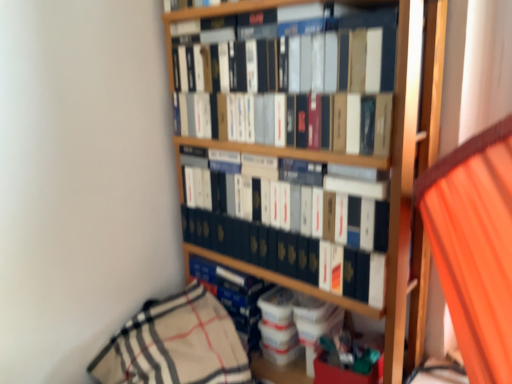
Question: Should I look upward or downward to see matte black book at upper center, which appears as the 1th book when viewed from the top?

Choices:
 (A) down
 (B) up

Answer: (B)

Question: Is blue hardcover book at center, which appears as the 1th book when ordered from the bottom, wider than matte black book at upper center, which appears as the 1th book when viewed from the top?

Choices:
 (A) yes
 (B) no

Answer: (A)

Question: Considering the relative sizes of blue hardcover book at center, the 3th book from the top, and matte black book at upper center, which appears as the 1th book when viewed from the top, in the image provided, is blue hardcover book at center, the 3th book from the top, taller than matte black book at upper center, which appears as the 1th book when viewed from the top,?

Choices:
 (A) no
 (B) yes

Answer: (A)

Question: Is blue hardcover book at center, which appears as the 1th book when ordered from the bottom, completely or partially outside of matte black book at upper center, which appears as the 1th book when viewed from the top?

Choices:
 (A) no
 (B) yes

Answer: (B)

Question: Is blue hardcover book at center, which appears as the 1th book when ordered from the bottom, positioned in front of matte black book at upper center, which appears as the 1th book when viewed from the top?

Choices:
 (A) yes
 (B) no

Answer: (B)

Question: From a real-world perspective, is blue hardcover book at center, which appears as the 1th book when ordered from the bottom, located higher than matte black book at upper center, the 3th book in the bottom-to-top sequence?

Choices:
 (A) no
 (B) yes

Answer: (A)

Question: Is blue hardcover book at center, which appears as the 1th book when ordered from the bottom, positioned with its back to matte black book at upper center, which appears as the 1th book when viewed from the top?

Choices:
 (A) no
 (B) yes

Answer: (A)

Question: Considering the relative sizes of matte black book at center, which is the 2th book in top-to-bottom order, and matte black book at upper center, which appears as the 1th book when viewed from the top, in the image provided, is matte black book at center, which is the 2th book in top-to-bottom order, bigger than matte black book at upper center, which appears as the 1th book when viewed from the top,?

Choices:
 (A) yes
 (B) no

Answer: (B)

Question: Does matte black book at center, which is the 2th book in top-to-bottom order, lie behind matte black book at upper center, which appears as the 1th book when viewed from the top?

Choices:
 (A) yes
 (B) no

Answer: (A)

Question: Does matte black book at center, the 2th book from the bottom, come in front of matte black book at upper center, the 3th book in the bottom-to-top sequence?

Choices:
 (A) no
 (B) yes

Answer: (A)

Question: From the image's perspective, is matte black book at center, which is the 2th book in top-to-bottom order, on top of matte black book at upper center, which appears as the 1th book when viewed from the top?

Choices:
 (A) no
 (B) yes

Answer: (A)

Question: Can we say matte black book at center, the 2th book from the bottom, lies outside matte black book at upper center, the 3th book in the bottom-to-top sequence?

Choices:
 (A) no
 (B) yes

Answer: (B)

Question: From a real-world perspective, is matte black book at center, the 2th book from the bottom, physically above matte black book at upper center, which appears as the 1th book when viewed from the top?

Choices:
 (A) yes
 (B) no

Answer: (B)

Question: Is matte black book at upper center, the 3th book in the bottom-to-top sequence, bigger than matte black book at center, which is the 2th book in top-to-bottom order?

Choices:
 (A) yes
 (B) no

Answer: (A)